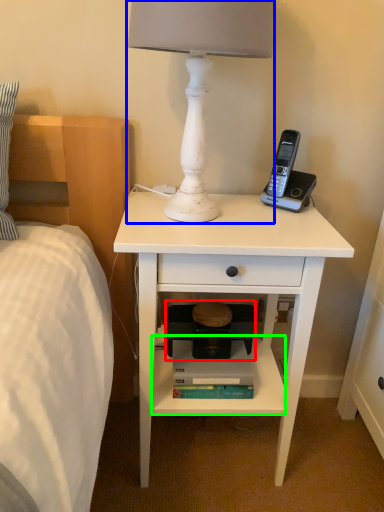
Question: Based on their relative distances, which object is farther from step stool (highlighted by a red box)? Choose from lamp (highlighted by a blue box) and shelf (highlighted by a green box).

Choices:
 (A) lamp
 (B) shelf

Answer: (A)